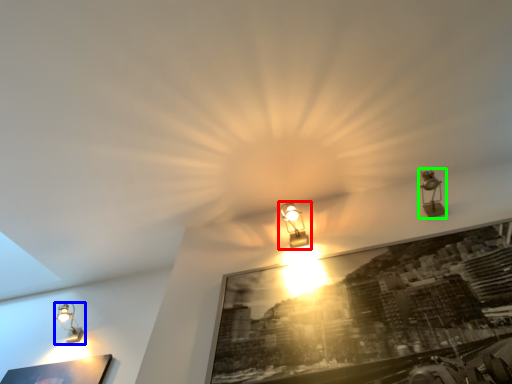
Question: Which is nearer to the lamp (highlighted by a red box)? lamp (highlighted by a blue box) or lamp (highlighted by a green box).

Choices:
 (A) lamp
 (B) lamp

Answer: (B)